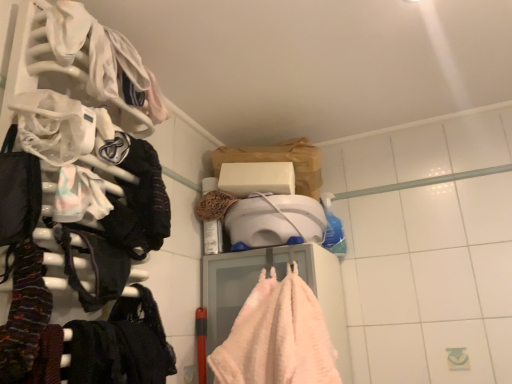
Question: Can you confirm if white plastic hanger at left is shorter than pastel cotton bib at left, which ranks as the 1th clothing in back-to-front order?

Choices:
 (A) no
 (B) yes

Answer: (A)

Question: From a real-world perspective, is white plastic hanger at left positioned under pastel cotton bib at left, which ranks as the second clothing in front-to-back order, based on gravity?

Choices:
 (A) yes
 (B) no

Answer: (B)

Question: Is white plastic hanger at left in contact with pastel cotton bib at left, which ranks as the 1th clothing in back-to-front order?

Choices:
 (A) no
 (B) yes

Answer: (A)

Question: Is white plastic hanger at left turned away from pastel cotton bib at left, which appears as the first clothing when viewed from the top?

Choices:
 (A) no
 (B) yes

Answer: (B)

Question: Can you confirm if white plastic hanger at left is taller than pastel cotton bib at left, which ranks as the 1th clothing in back-to-front order?

Choices:
 (A) yes
 (B) no

Answer: (A)

Question: Is the position of white plastic hanger at left more distant than that of pastel cotton bib at left, which ranks as the 1th clothing in back-to-front order?

Choices:
 (A) yes
 (B) no

Answer: (B)

Question: Considering the relative sizes of pastel cotton bib at left, the second clothing from the bottom, and knitted wool scarf at left, the 2th clothing viewed from the back, in the image provided, is pastel cotton bib at left, the second clothing from the bottom, bigger than knitted wool scarf at left, the 2th clothing viewed from the back,?

Choices:
 (A) yes
 (B) no

Answer: (A)

Question: From a real-world perspective, is pastel cotton bib at left, which appears as the first clothing when viewed from the top, positioned over knitted wool scarf at left, which ranks as the first clothing in bottom-to-top order, based on gravity?

Choices:
 (A) no
 (B) yes

Answer: (B)

Question: Does pastel cotton bib at left, which ranks as the 1th clothing in back-to-front order, appear on the right side of knitted wool scarf at left, marked as the 2th clothing in a top-to-bottom arrangement?

Choices:
 (A) yes
 (B) no

Answer: (A)

Question: Does pastel cotton bib at left, which ranks as the second clothing in front-to-back order, have a greater height compared to knitted wool scarf at left, the 2th clothing viewed from the back?

Choices:
 (A) no
 (B) yes

Answer: (A)

Question: Is pastel cotton bib at left, the second clothing from the bottom, thinner than knitted wool scarf at left, which ranks as the first clothing in bottom-to-top order?

Choices:
 (A) no
 (B) yes

Answer: (A)

Question: Is knitted wool scarf at left, arranged as the first clothing when viewed from the front, at the back of pastel cotton bib at left, the second clothing from the bottom?

Choices:
 (A) no
 (B) yes

Answer: (A)

Question: Can you confirm if pastel cotton bib at left, which appears as the first clothing when viewed from the top, is thinner than white plastic hanger at left?

Choices:
 (A) no
 (B) yes

Answer: (B)